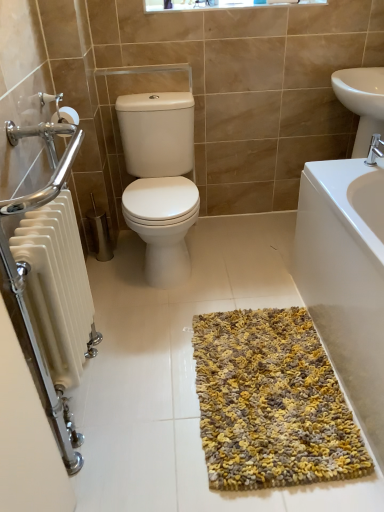
Question: Is point click(355, 205) closer or farther from the camera than point click(377, 145)?

Choices:
 (A) farther
 (B) closer

Answer: (B)

Question: From a real-world perspective, is yellow textured bath mat at lower right physically located above or below silver metallic faucet at upper right?

Choices:
 (A) above
 (B) below

Answer: (B)

Question: Which of these objects is positioned farthest from the white glossy toilet at center?

Choices:
 (A) yellow textured bath mat at lower right
 (B) white plastic window frame at upper center
 (C) yellow-grey shaggy rug at center
 (D) silver metallic faucet at upper right
 (E) white glossy sink at upper right

Answer: (D)

Question: Which object is the farthest from the yellow textured bath mat at lower right?

Choices:
 (A) silver metallic faucet at upper right
 (B) white glossy toilet at center
 (C) white plastic window frame at upper center
 (D) yellow-grey shaggy rug at center
 (E) white glossy sink at upper right

Answer: (C)